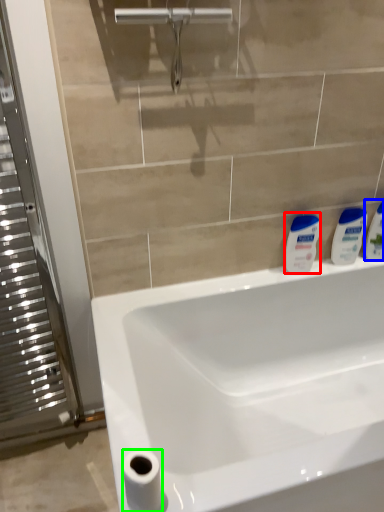
Question: Which is nearer to the cleaning product (highlighted by a red box)? toiletry (highlighted by a blue box) or toilet paper (highlighted by a green box).

Choices:
 (A) toiletry
 (B) toilet paper

Answer: (A)